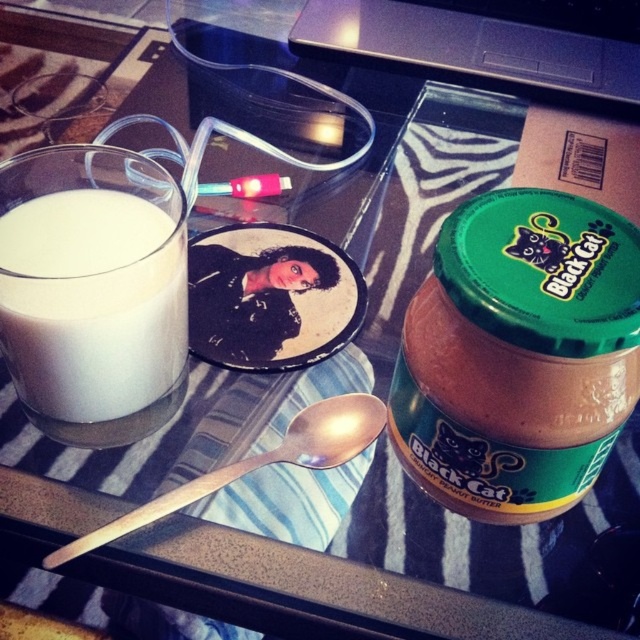
Consider the image. Is brown smooth peanut butter jar at center right thinner than wooden spoon at center?

Correct, brown smooth peanut butter jar at center right's width is less than wooden spoon at center's.

Does point (563, 500) come farther from viewer compared to point (61, 557)?

That is True.

You are a GUI agent. You are given a task and a screenshot of the screen. Output one action in this format:
    pyautogui.click(x=<x>, y=<y>)
    Task: Click on the brown smooth peanut butter jar at center right
    The width and height of the screenshot is (640, 640).
    Given the screenshot: What is the action you would take?
    pyautogui.click(x=518, y=355)

The image size is (640, 640). Describe the element at coordinates (518, 355) in the screenshot. I see `brown smooth peanut butter jar at center right` at that location.

Can you confirm if brown smooth peanut butter jar at center right is positioned below white matte glass at left?

Indeed, brown smooth peanut butter jar at center right is positioned under white matte glass at left.

The height and width of the screenshot is (640, 640). Describe the element at coordinates (518, 355) in the screenshot. I see `brown smooth peanut butter jar at center right` at that location.

Identify the location of brown smooth peanut butter jar at center right. (518, 355).

Is point (96, 388) less distant than point (166, 508)?

That is False.

Does white matte glass at left have a greater width compared to wooden spoon at center?

No.

Between point (83, 406) and point (346, 444), which one is positioned behind?

The point (346, 444) is more distant.

Identify the location of white matte glass at left. The width and height of the screenshot is (640, 640). (92, 305).